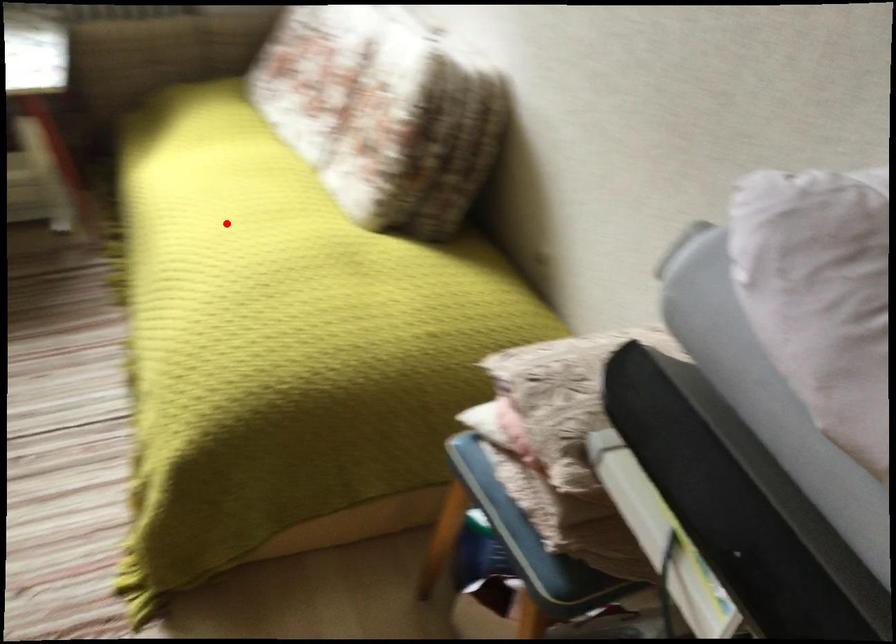
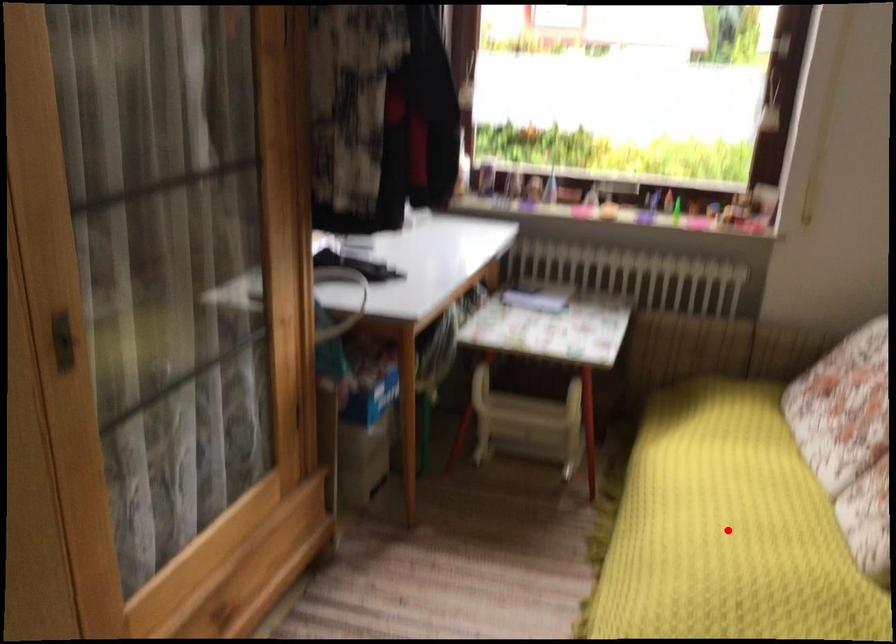
I am providing you with two images of the same scene from different viewpoints. A red point is marked on the first image and another point is marked on the second image. Is the marked point in image1 the same physical position as the marked point in image2?

Yes